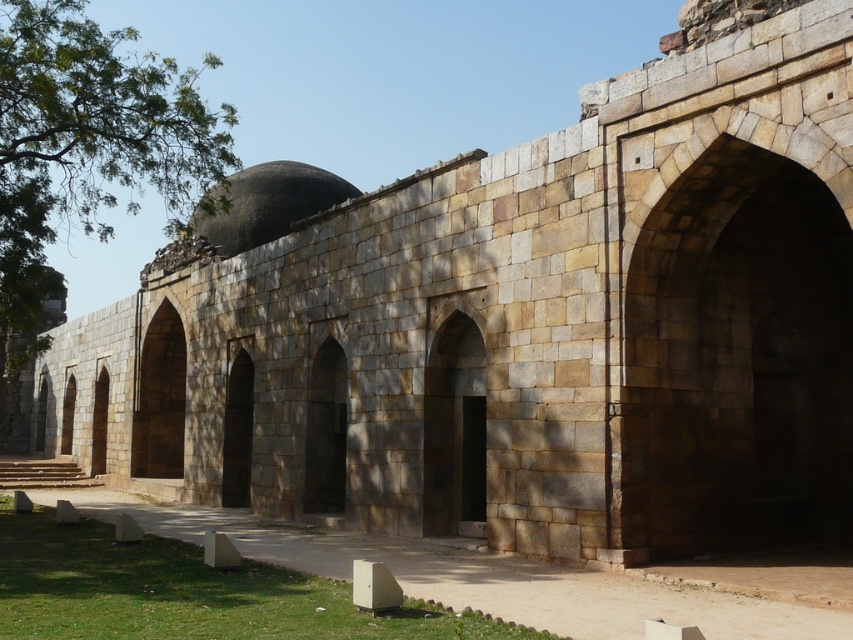
Is point (840, 472) less distant than point (218, 196)?

Yes.

The height and width of the screenshot is (640, 853). Identify the location of brown stone arch at right. (737, 362).

Locate an element on the screen. brown stone arch at right is located at coordinates point(737,362).